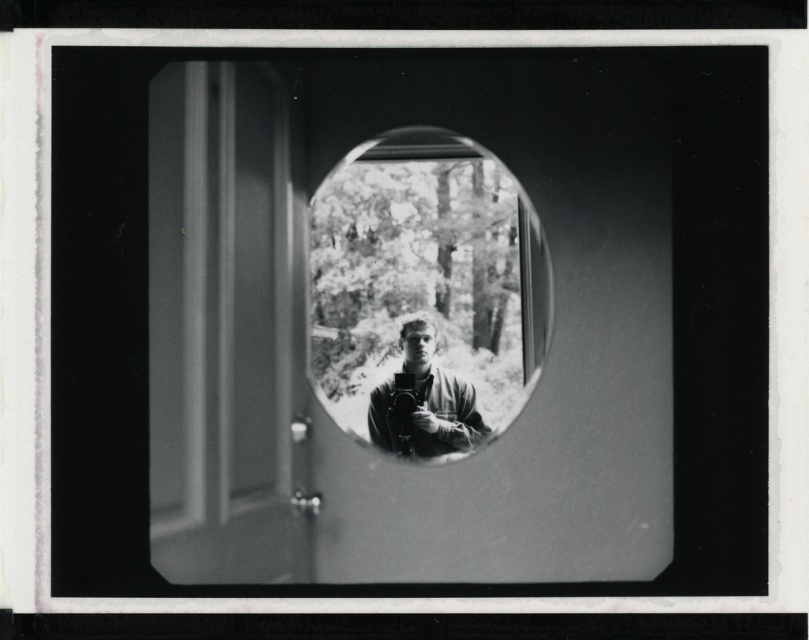
Is smooth glass mirror at center below smooth black camera at center?

Incorrect, smooth glass mirror at center is not positioned below smooth black camera at center.

Is the position of smooth glass mirror at center more distant than that of smooth black camera at center?

No, it is not.

Between point (371, 445) and point (397, 444), which one is positioned behind?

Point (397, 444)

I want to click on smooth glass mirror at center, so click(424, 294).